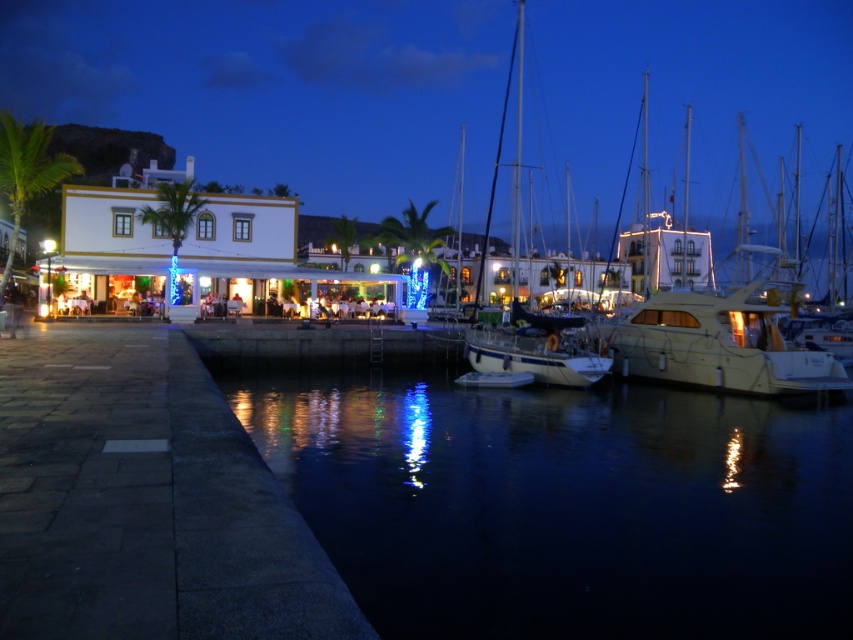
Question: Which point is farther to the camera?

Choices:
 (A) white glossy sailboat at center
 (B) matte yellow boat at right
 (C) dark reflective water at lower center

Answer: (B)

Question: Does white glossy yacht at center have a greater width compared to matte yellow boat at right?

Choices:
 (A) yes
 (B) no

Answer: (A)

Question: Which object is farther from the camera taking this photo?

Choices:
 (A) dark reflective water at lower center
 (B) white glossy sailboat at center
 (C) white glossy yacht at center
 (D) matte yellow boat at right

Answer: (D)

Question: Which of the following is the closest to the observer?

Choices:
 (A) (643, 516)
 (B) (659, 333)
 (C) (671, 353)
 (D) (540, 376)

Answer: (A)

Question: Does dark reflective water at lower center appear over matte yellow boat at right?

Choices:
 (A) yes
 (B) no

Answer: (B)

Question: Is dark reflective water at lower center below white glossy sailboat at center?

Choices:
 (A) yes
 (B) no

Answer: (A)